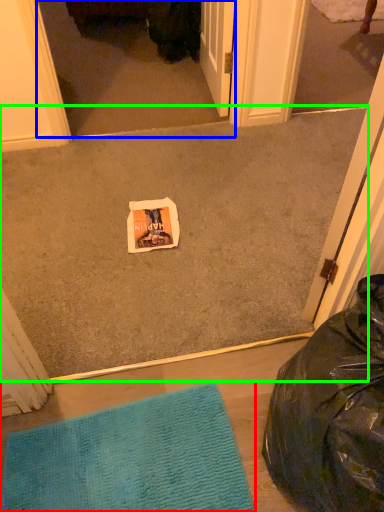
Question: Considering the real-world distances, which object is closest to mat (highlighted by a red box)? screen door (highlighted by a blue box) or concrete (highlighted by a green box).

Choices:
 (A) screen door
 (B) concrete

Answer: (B)